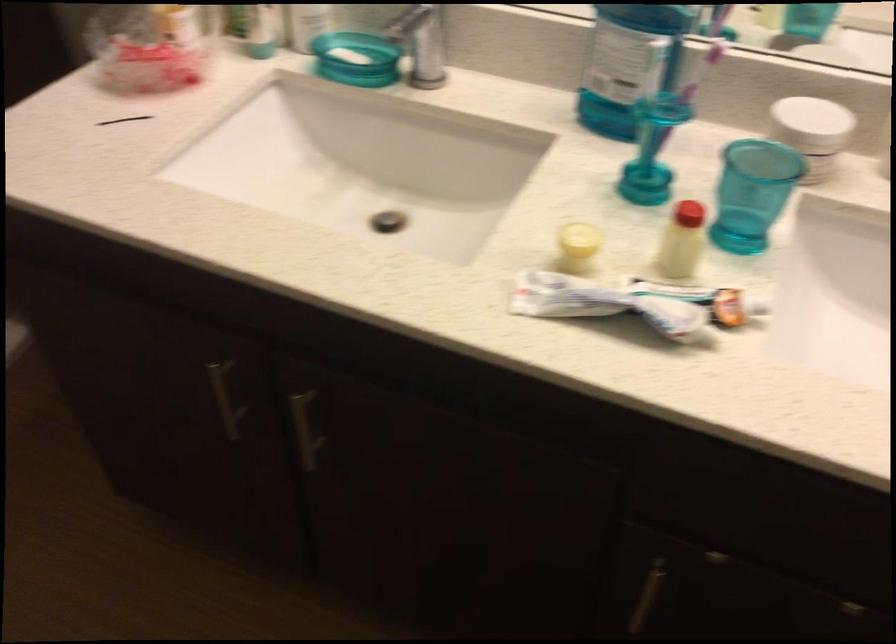
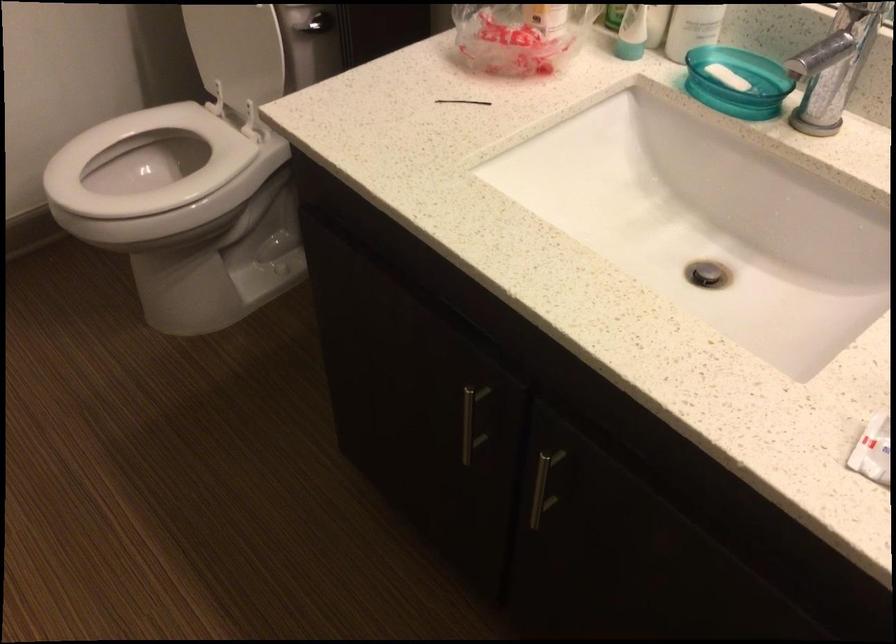
Locate, in the second image, the point that corresponds to point 300,426 in the first image.

(543, 486)